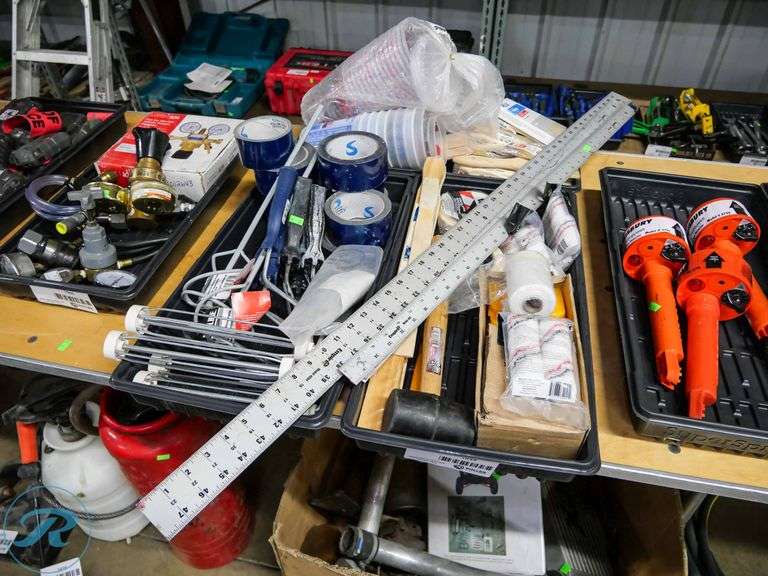
You are a GUI agent. You are given a task and a screenshot of the screen. Output one action in this format:
    pyautogui.click(x=<x>, y=<y>)
    Task: Click on the floor tile
    This screenshot has width=768, height=576.
    Given the screenshot: What is the action you would take?
    pyautogui.click(x=150, y=559)